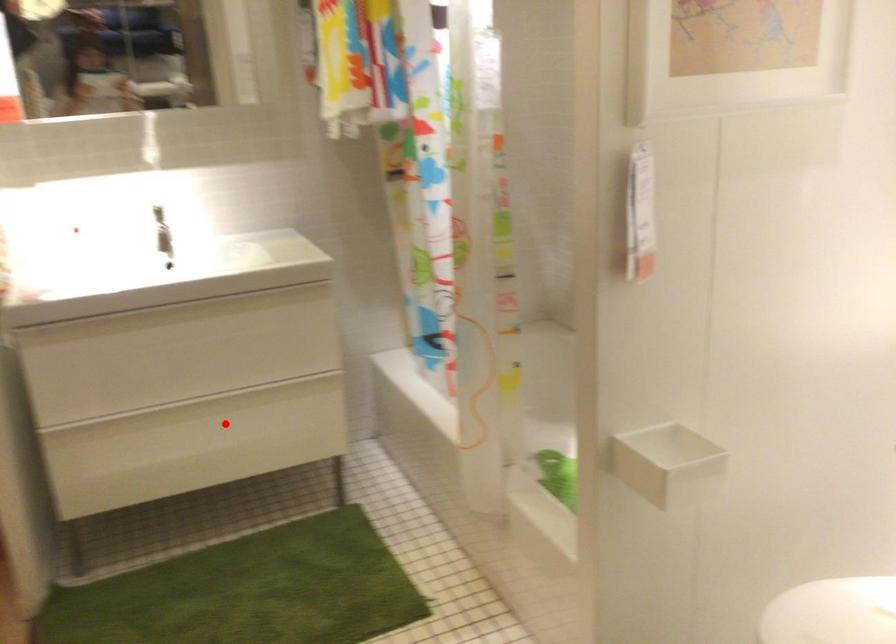
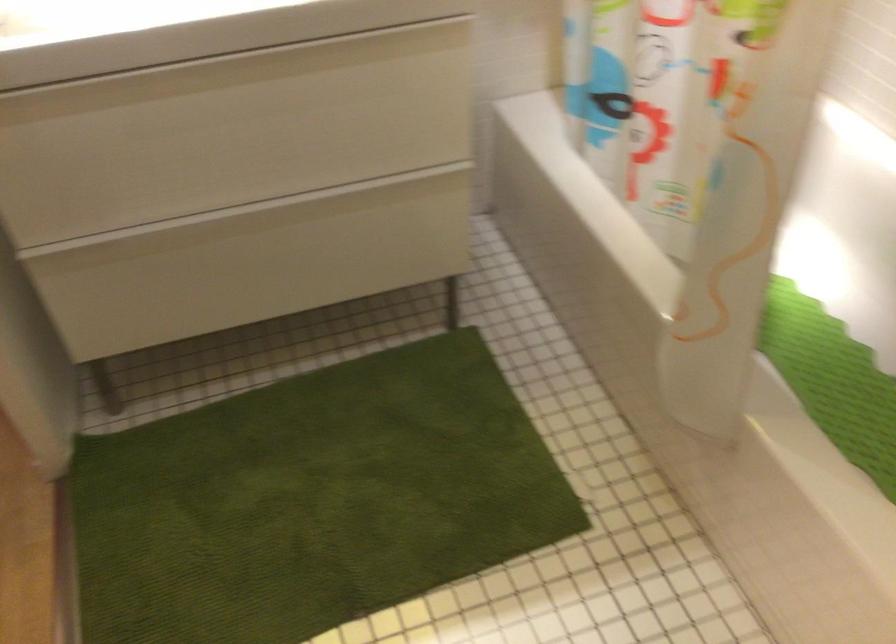
Question: I am providing you with two images of the same scene from different viewpoints. In image1, a red point is highlighted. Considering the same 3D point in image2, which of the following is correct?

Choices:
 (A) It is closer
 (B) It is farther

Answer: (A)